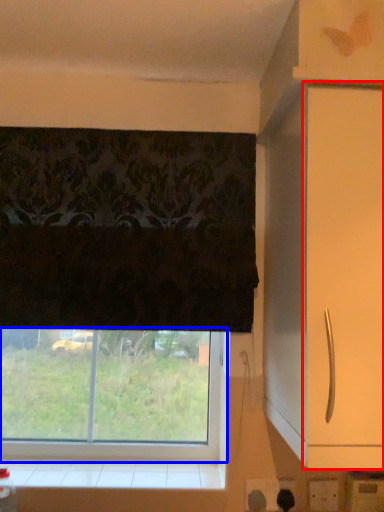
Question: Among these objects, which one is farthest to the camera, screen door (highlighted by a red box) or window (highlighted by a blue box)?

Choices:
 (A) screen door
 (B) window

Answer: (B)